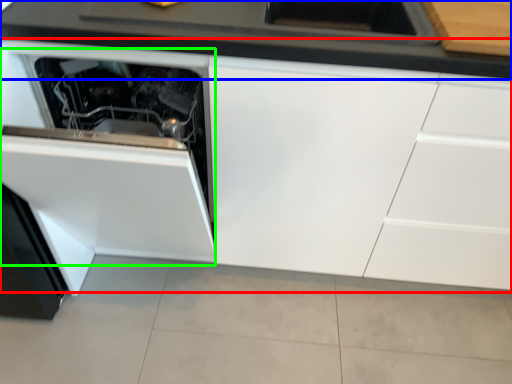
Question: Estimate the real-world distances between objects in this image. Which object is farther from cabinetry (highlighted by a red box), countertop (highlighted by a blue box) or oven (highlighted by a green box)?

Choices:
 (A) countertop
 (B) oven

Answer: (A)